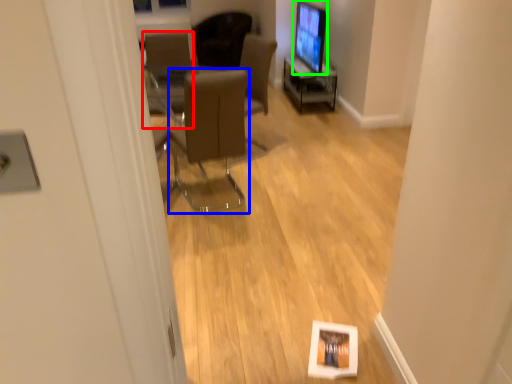
Question: Considering the real-world distances, which object is farthest from chair (highlighted by a red box)? chair (highlighted by a blue box) or computer monitor (highlighted by a green box)?

Choices:
 (A) chair
 (B) computer monitor

Answer: (B)